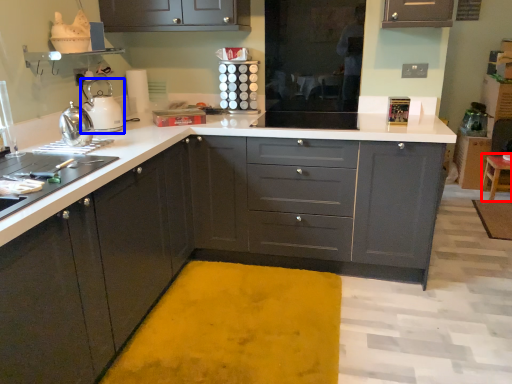
Question: Which object is further to the camera taking this photo, stool (highlighted by a red box) or kitchen appliance (highlighted by a blue box)?

Choices:
 (A) stool
 (B) kitchen appliance

Answer: (A)